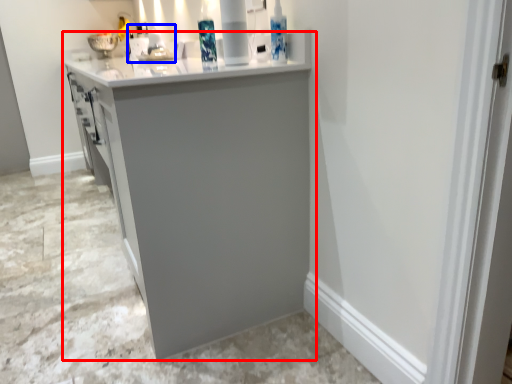
Question: Among these objects, which one is nearest to the camera, cabinetry (highlighted by a red box) or sink (highlighted by a blue box)?

Choices:
 (A) cabinetry
 (B) sink

Answer: (A)